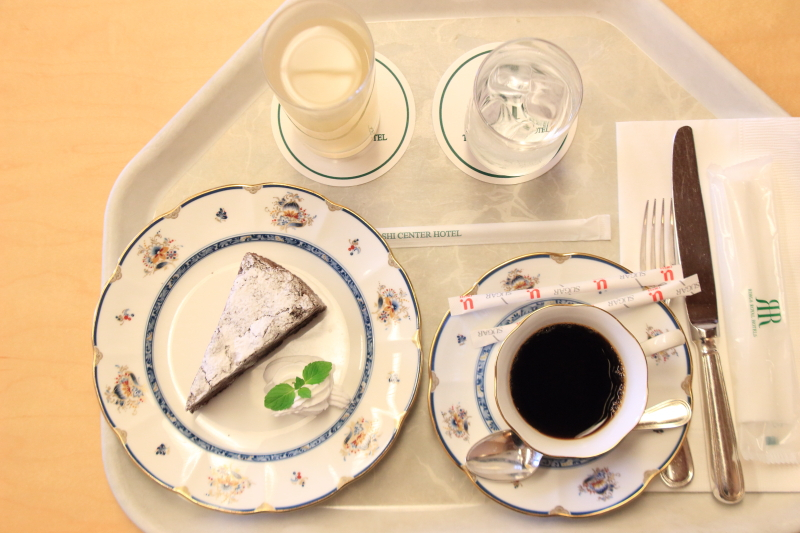
You are a GUI agent. You are given a task and a screenshot of the screen. Output one action in this format:
    pyautogui.click(x=<x>, y=<y>)
    Task: Click on the paper napkin
    This screenshot has height=533, width=800.
    Given the screenshot: What is the action you would take?
    pyautogui.click(x=720, y=143)